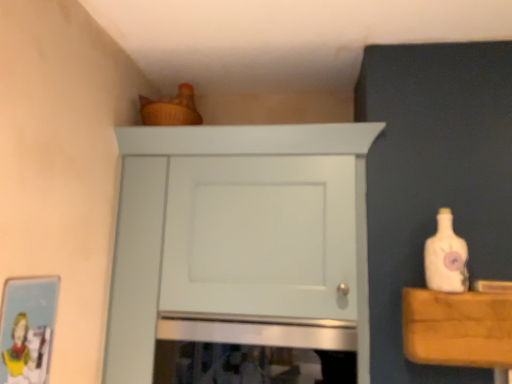
What do you see at coordinates (240, 240) in the screenshot?
I see `white matte cabinet at upper center` at bounding box center [240, 240].

What do you see at coordinates (446, 257) in the screenshot?
I see `white matte bottle at right` at bounding box center [446, 257].

Where is `white matte cabinet at upper center`? The width and height of the screenshot is (512, 384). white matte cabinet at upper center is located at coordinates (240, 240).

In the scene shown: Considering the relative sizes of matte cardboard picture frame at lower left and white matte cabinet at upper center in the image provided, is matte cardboard picture frame at lower left taller than white matte cabinet at upper center?

Incorrect, the height of matte cardboard picture frame at lower left is not larger of that of white matte cabinet at upper center.

Consider the image. Is matte cardboard picture frame at lower left inside the boundaries of white matte cabinet at upper center, or outside?

matte cardboard picture frame at lower left exists outside the volume of white matte cabinet at upper center.

In the scene shown: Is matte cardboard picture frame at lower left positioned with its back to white matte cabinet at upper center?

matte cardboard picture frame at lower left does not have its back to white matte cabinet at upper center.

From a real-world perspective, between matte cardboard picture frame at lower left and white matte cabinet at upper center, who is vertically lower?

matte cardboard picture frame at lower left, from a real-world perspective.

Does matte cardboard picture frame at lower left touch white matte bottle at right?

matte cardboard picture frame at lower left and white matte bottle at right are not in contact.

Is matte cardboard picture frame at lower left taller or shorter than white matte bottle at right?

Clearly, matte cardboard picture frame at lower left is taller compared to white matte bottle at right.

Can you tell me how much matte cardboard picture frame at lower left and white matte bottle at right differ in facing direction?

85.9 degrees separate the facing orientations of matte cardboard picture frame at lower left and white matte bottle at right.

From a real-world perspective, is matte cardboard picture frame at lower left beneath white matte bottle at right?

Correct, in the physical world, matte cardboard picture frame at lower left is lower than white matte bottle at right.

Does white matte bottle at right touch white matte cabinet at upper center?

They are not placed beside each other.

Could you tell me if white matte bottle at right is facing white matte cabinet at upper center?

No.

In the scene shown: From the image's perspective, is white matte bottle at right under white matte cabinet at upper center?

Actually, white matte bottle at right appears above white matte cabinet at upper center in the image.

Which is more to the left, white matte bottle at right or white matte cabinet at upper center?

white matte cabinet at upper center.

Does point (430, 240) come behind point (47, 302)?

Yes, it is behind point (47, 302).

How many degrees apart are the facing directions of white matte bottle at right and matte cardboard picture frame at lower left?

They differ by 85.9 degrees in their facing directions.

At what (x,y) coordinates should I click in order to perform the action: click on picture frame located in front of the white matte bottle at right. Please return your answer as a coordinate pair (x, y). The width and height of the screenshot is (512, 384). Looking at the image, I should click on (27, 329).

Does white matte bottle at right have a lesser width compared to matte cardboard picture frame at lower left?

Incorrect, the width of white matte bottle at right is not less than that of matte cardboard picture frame at lower left.

Which of these two, white matte cabinet at upper center or white matte bottle at right, stands shorter?

With less height is white matte bottle at right.

Consider the image. Is the depth of white matte cabinet at upper center less than that of white matte bottle at right?

No, it is behind white matte bottle at right.

From the image's perspective, who appears lower, white matte cabinet at upper center or white matte bottle at right?

white matte cabinet at upper center, from the image's perspective.

Does white matte cabinet at upper center have a lesser height compared to matte cardboard picture frame at lower left?

No, white matte cabinet at upper center is not shorter than matte cardboard picture frame at lower left.

Is white matte cabinet at upper center at the left side of matte cardboard picture frame at lower left?

Incorrect, white matte cabinet at upper center is not on the left side of matte cardboard picture frame at lower left.

Is point (227, 202) positioned in front of point (26, 303)?

No.

I want to click on cupboard that is on the right side of matte cardboard picture frame at lower left, so click(240, 240).

You are a GUI agent. You are given a task and a screenshot of the screen. Output one action in this format:
    pyautogui.click(x=<x>, y=<y>)
    Task: Click on the cupboard above the matte cardboard picture frame at lower left (from the image's perspective)
    
    Given the screenshot: What is the action you would take?
    pyautogui.click(x=240, y=240)

This screenshot has height=384, width=512. Find the location of `picture frame below the white matte bottle at right (from a real-world perspective)`. picture frame below the white matte bottle at right (from a real-world perspective) is located at coordinates (27, 329).

Based on their spatial positions, is white matte bottle at right or matte cardboard picture frame at lower left further from white matte cabinet at upper center?

Among the two, white matte bottle at right is located further to white matte cabinet at upper center.

Looking at the image, which one is located closer to white matte bottle at right, matte cardboard picture frame at lower left or white matte cabinet at upper center?

white matte cabinet at upper center is positioned closer to the anchor white matte bottle at right.

When comparing their distances from white matte cabinet at upper center, does matte cardboard picture frame at lower left or white matte bottle at right seem closer?

matte cardboard picture frame at lower left is closer to white matte cabinet at upper center.

Considering their positions, is white matte cabinet at upper center positioned closer to white matte bottle at right than matte cardboard picture frame at lower left?

Among the two, white matte cabinet at upper center is located nearer to white matte bottle at right.

From the image, which object appears to be nearer to matte cardboard picture frame at lower left, white matte cabinet at upper center or white matte bottle at right?

Based on the image, white matte cabinet at upper center appears to be nearer to matte cardboard picture frame at lower left.

Considering their positions, is white matte bottle at right positioned further to matte cardboard picture frame at lower left than white matte cabinet at upper center?

Based on the image, white matte bottle at right appears to be further to matte cardboard picture frame at lower left.

At what (x,y) coordinates should I click in order to perform the action: click on cupboard situated between matte cardboard picture frame at lower left and white matte bottle at right from left to right. Please return your answer as a coordinate pair (x, y). The width and height of the screenshot is (512, 384). Looking at the image, I should click on (240, 240).